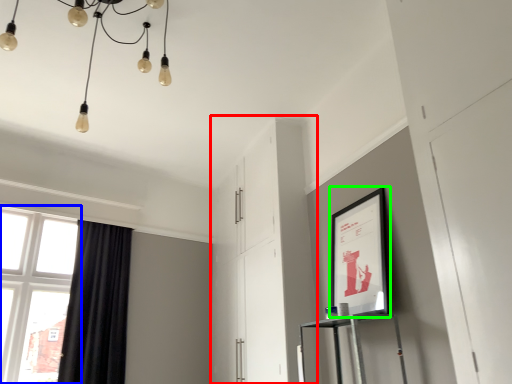
Question: Estimate the real-world distances between objects in this image. Which object is farther from dresser (highlighted by a red box), window (highlighted by a blue box) or picture frame (highlighted by a green box)?

Choices:
 (A) window
 (B) picture frame

Answer: (A)